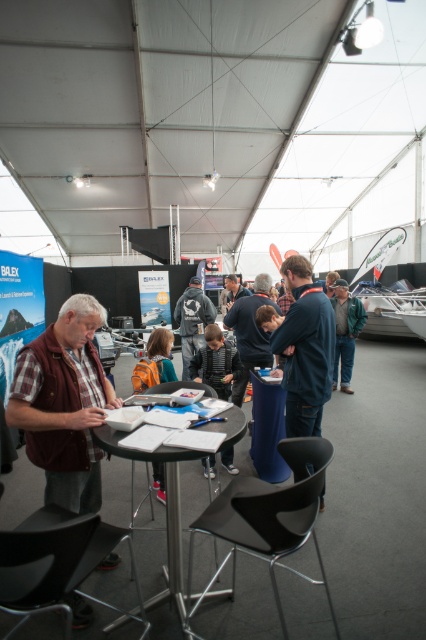
Question: Does dark blue jeans at center have a lesser width compared to green leather jacket at center?

Choices:
 (A) yes
 (B) no

Answer: (A)

Question: From the image, what is the correct spatial relationship of dark blue shirt at center in relation to dark gray fabric jacket at center?

Choices:
 (A) left
 (B) right

Answer: (B)

Question: Does plaid fabric shirt at center have a greater width compared to black metal table at center?

Choices:
 (A) no
 (B) yes

Answer: (A)

Question: Which object appears closest to the camera in this image?

Choices:
 (A) plaid fabric shirt at center
 (B) dark blue jeans at center
 (C) dark gray fabric jacket at center
 (D) dark blue shirt at center

Answer: (A)

Question: Which of the following is the closest to the observer?

Choices:
 (A) black metal table at center
 (B) plaid fabric shirt at center
 (C) dark blue jeans at center
 (D) dark blue shirt at center

Answer: (A)

Question: Which point is closer to the camera taking this photo?

Choices:
 (A) (181, 611)
 (B) (198, 332)

Answer: (A)